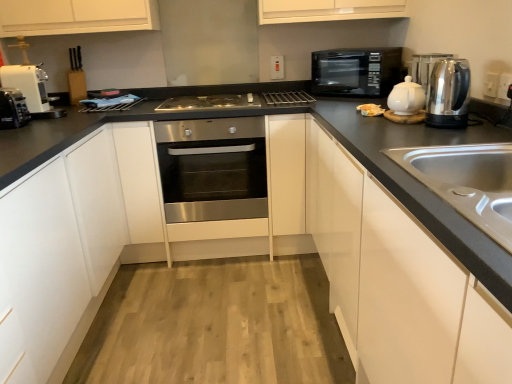
How much space does white matte cabinet at lower left, the second cabinetry when ordered from right to left, occupy horizontally?

white matte cabinet at lower left, the second cabinetry when ordered from right to left, is 24.85 inches wide.

Image resolution: width=512 pixels, height=384 pixels. Describe the element at coordinates (467, 181) in the screenshot. I see `stainless steel sink at right` at that location.

This screenshot has width=512, height=384. I want to click on white glossy cabinet at right, the 2th cabinetry viewed from the left, so click(x=397, y=281).

Can you confirm if satin silver kettle at upper right is positioned to the left of white matte cabinet at lower left, the second cabinetry when ordered from right to left?

No.

Is satin silver kettle at upper right bigger or smaller than white matte cabinet at lower left, the second cabinetry when ordered from right to left?

Clearly, satin silver kettle at upper right is smaller in size than white matte cabinet at lower left, the second cabinetry when ordered from right to left.

From a real-world perspective, who is located higher, satin silver kettle at upper right or white matte cabinet at lower left, the first cabinetry in the left-to-right sequence?

In real-world perspective, satin silver kettle at upper right is above.

Between satin silver kettle at upper right and white matte cabinet at lower left, the first cabinetry in the left-to-right sequence, which one has less height?

With less height is satin silver kettle at upper right.

Is white plastic toaster at left wider than stainless steel gas stove at center?

Incorrect, the width of white plastic toaster at left does not surpass that of stainless steel gas stove at center.

Measure the distance between white plastic toaster at left and stainless steel gas stove at center.

The distance of white plastic toaster at left from stainless steel gas stove at center is 37.99 inches.

In the scene shown: Is white plastic toaster at left at the left side of stainless steel gas stove at center?

Yes, white plastic toaster at left is to the left of stainless steel gas stove at center.

Are white plastic toaster at left and stainless steel gas stove at center far apart?

No.

In the scene shown: Considering the sizes of objects stainless steel sink at right and white glossy cabinet at right, the 2th cabinetry viewed from the left, in the image provided, who is shorter, stainless steel sink at right or white glossy cabinet at right, the 2th cabinetry viewed from the left,?

Standing shorter between the two is stainless steel sink at right.

Does stainless steel sink at right lie behind white glossy cabinet at right, the 2th cabinetry viewed from the left?

Yes, it is.

From the image's perspective, does stainless steel sink at right appear lower than white glossy cabinet at right, which is counted as the first cabinetry, starting from the right?

No, from the image's perspective, stainless steel sink at right is not below white glossy cabinet at right, which is counted as the first cabinetry, starting from the right.

Based on the photo, considering the sizes of objects white plastic coffee machine at left and black matte microwave at upper right in the image provided, who is shorter, white plastic coffee machine at left or black matte microwave at upper right?

Standing shorter between the two is white plastic coffee machine at left.

From the picture: Is white plastic coffee machine at left next to black matte microwave at upper right and touching it?

No, white plastic coffee machine at left is not touching black matte microwave at upper right.

Is white plastic coffee machine at left further to camera compared to black matte microwave at upper right?

No, it is not.

From a real-world perspective, which is physically above, white plastic coffee machine at left or black matte microwave at upper right?

black matte microwave at upper right, from a real-world perspective.

Is brushed metal faucet at upper left looking in the opposite direction of stainless steel oven at center?

No, brushed metal faucet at upper left is not facing the opposite direction of stainless steel oven at center.

What's the angular difference between brushed metal faucet at upper left and stainless steel oven at center's facing directions?

The angle between the facing direction of brushed metal faucet at upper left and the facing direction of stainless steel oven at center is 1.1 degrees.

Which of these two, brushed metal faucet at upper left or stainless steel oven at center, stands taller?

stainless steel oven at center is taller.

Is white plastic coffee machine at left surrounded by white plastic electric outlet at upper right, the second electric outlet from the back?

No, white plastic coffee machine at left is not inside white plastic electric outlet at upper right, the second electric outlet from the back.

In terms of width, does white plastic electric outlet at upper right, which appears as the 1th electric outlet when ordered from the bottom, look wider or thinner when compared to white plastic coffee machine at left?

Clearly, white plastic electric outlet at upper right, which appears as the 1th electric outlet when ordered from the bottom, has less width compared to white plastic coffee machine at left.

Is point (507, 90) less distant than point (21, 83)?

Yes.

Is white plastic electric outlet at upper right, which appears as the 1th electric outlet when ordered from the bottom, facing away from white plastic coffee machine at left?

No, white plastic electric outlet at upper right, which appears as the 1th electric outlet when ordered from the bottom, is not facing away from white plastic coffee machine at left.

Looking at this image, from a real-world perspective, which object rests below the other?

In real-world perspective, white plastic electric outlet at upper right, arranged as the 2th electric outlet when viewed from the left, is lower.

How distant is brushed metal faucet at upper left from white plastic electric outlet at upper right, arranged as the 2th electric outlet when viewed from the left?

They are 7.88 feet apart.

Which is in front, brushed metal faucet at upper left or white plastic electric outlet at upper right, the second electric outlet from the back?

white plastic electric outlet at upper right, the second electric outlet from the back.

Is brushed metal faucet at upper left not close to white plastic electric outlet at upper right, the 1th electric outlet when ordered from right to left?

Indeed, brushed metal faucet at upper left is not near white plastic electric outlet at upper right, the 1th electric outlet when ordered from right to left.

Image resolution: width=512 pixels, height=384 pixels. I want to click on appliance that appears above the white matte cabinet at lower left, the second cabinetry when ordered from right to left (from a real-world perspective), so click(x=425, y=67).

The image size is (512, 384). In order to click on toaster that appears in front of the stainless steel gas stove at center in this screenshot , I will do `click(13, 109)`.

Looking at the image, which one is located closer to white plastic toaster at left, white plastic electric outlet at upper center, the second electric outlet in the front-to-back sequence, or stainless steel oven at center?

stainless steel oven at center lies closer to white plastic toaster at left than the other object.

From the picture: Looking at the image, which one is located further to white matte cabinet at lower left, the first cabinetry in the left-to-right sequence, white plastic electric outlet at upper center, which is the 1th electric outlet in back-to-front order, or stainless steel oven at center?

Among the two, white plastic electric outlet at upper center, which is the 1th electric outlet in back-to-front order, is located further to white matte cabinet at lower left, the first cabinetry in the left-to-right sequence.

Based on their spatial positions, is black matte microwave at upper right or white plastic electric outlet at upper right, the second electric outlet from the back, closer to polished stainless steel kettle at right?

Among the two, white plastic electric outlet at upper right, the second electric outlet from the back, is located nearer to polished stainless steel kettle at right.

From the picture: When comparing their distances from white plastic toaster at left, does white glossy tea pot at upper right or polished stainless steel kettle at right seem further?

The object further to white plastic toaster at left is polished stainless steel kettle at right.

Looking at the image, which one is located further to black matte microwave at upper right, white matte cabinet at lower left, the second cabinetry when ordered from right to left, or white plastic electric outlet at upper center, which is the 1th electric outlet in back-to-front order?

white matte cabinet at lower left, the second cabinetry when ordered from right to left, lies further to black matte microwave at upper right than the other object.

Which object lies further to the anchor point stainless steel gas stove at center, white glossy tea pot at upper right or polished stainless steel kettle at right?

Based on the image, polished stainless steel kettle at right appears to be further to stainless steel gas stove at center.

Looking at the image, which one is located further to white glossy tea pot at upper right, polished stainless steel kettle at right or white plastic toaster at left?

white plastic toaster at left lies further to white glossy tea pot at upper right than the other object.

Considering their positions, is brushed metal faucet at upper left positioned further to white plastic coffee machine at left than polished stainless steel kettle at right?

polished stainless steel kettle at right is positioned further to the anchor white plastic coffee machine at left.

At what (x,y) coordinates should I click in order to perform the action: click on kitchen appliance positioned between stainless steel sink at right and white plastic electric outlet at upper right, which is the 1th electric outlet in front-to-back order, from near to far. Please return your answer as a coordinate pair (x, y). Image resolution: width=512 pixels, height=384 pixels. Looking at the image, I should click on (448, 94).

Find the location of a particular element. The height and width of the screenshot is (384, 512). gas stove between white plastic electric outlet at upper right, the 1th electric outlet when ordered from right to left, and white plastic electric outlet at upper center, acting as the 1th electric outlet starting from the left, from front to back is located at coordinates (209, 102).

Find the location of `cabinetry located between white matte cabinet at lower left, the second cabinetry when ordered from right to left, and satin silver kettle at upper right in the left-right direction`. cabinetry located between white matte cabinet at lower left, the second cabinetry when ordered from right to left, and satin silver kettle at upper right in the left-right direction is located at coordinates (397, 281).

Image resolution: width=512 pixels, height=384 pixels. Identify the location of tea pot located between stainless steel sink at right and stainless steel gas stove at center in the depth direction. (406, 98).